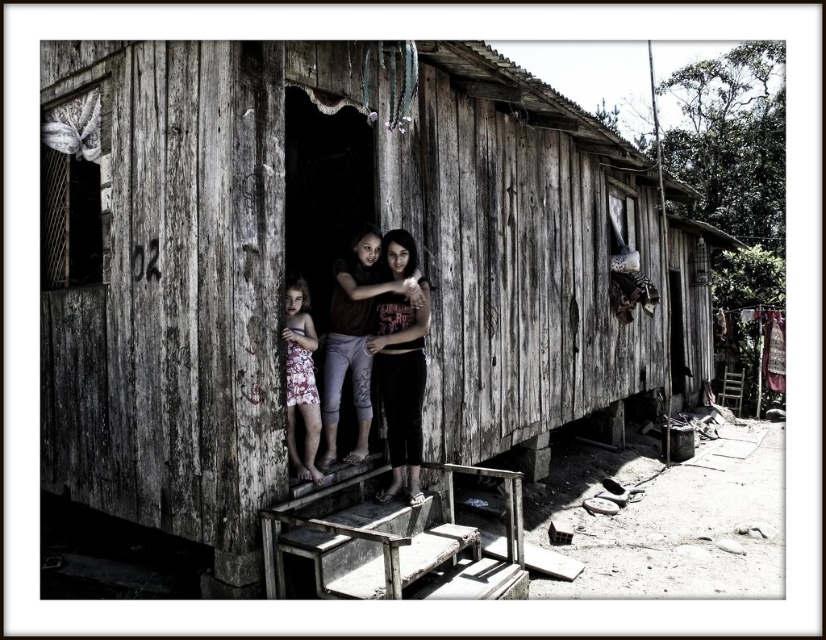
Question: Is weathered wood hut at center thinner than matte brown shirt at center?

Choices:
 (A) yes
 (B) no

Answer: (A)

Question: Which is nearer to the floral dress at center?

Choices:
 (A) matte brown shirt at center
 (B) dark brown fabric pants at center

Answer: (A)

Question: Does dark brown fabric pants at center have a lesser width compared to floral dress at center?

Choices:
 (A) no
 (B) yes

Answer: (A)

Question: Based on their relative distances, which object is farther from the floral dress at center?

Choices:
 (A) weathered wood hut at center
 (B) dark brown fabric pants at center
 (C) matte brown shirt at center

Answer: (A)

Question: Is matte brown shirt at center positioned before floral dress at center?

Choices:
 (A) yes
 (B) no

Answer: (B)

Question: Which object appears closest to the camera in this image?

Choices:
 (A) dark brown fabric pants at center
 (B) weathered wood hut at center
 (C) floral dress at center

Answer: (C)